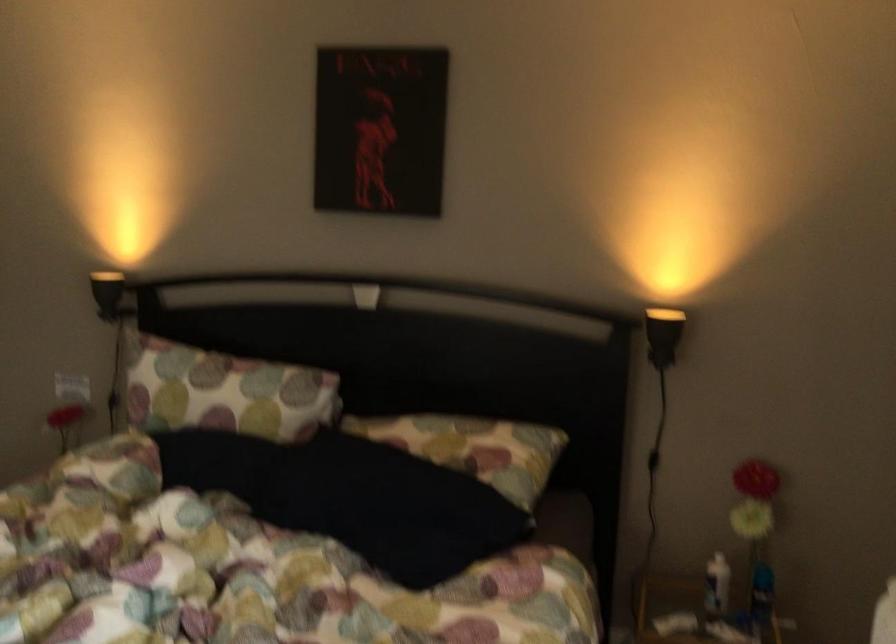
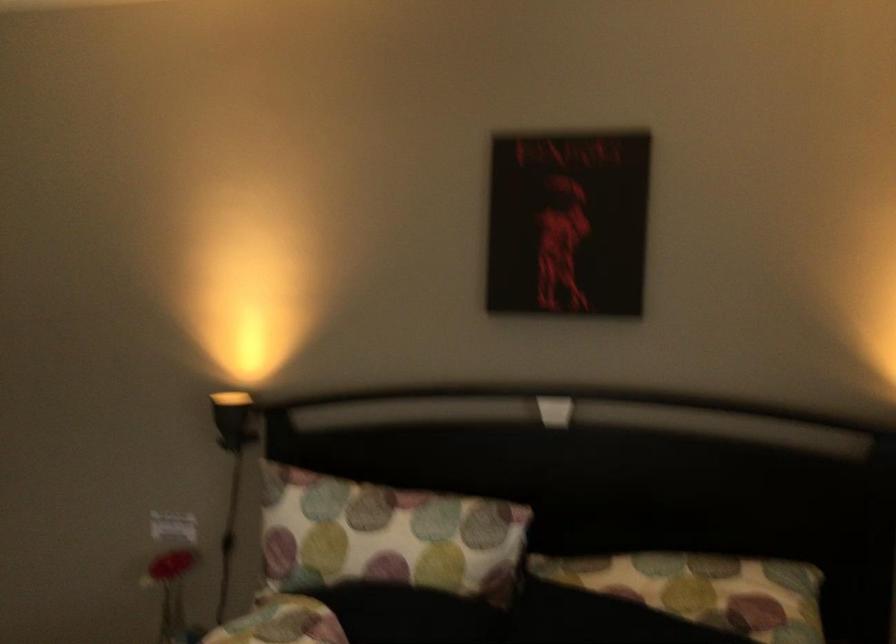
The images are taken continuously from a first-person perspective. In which direction are you moving?

The cameraman moved toward left, forward.